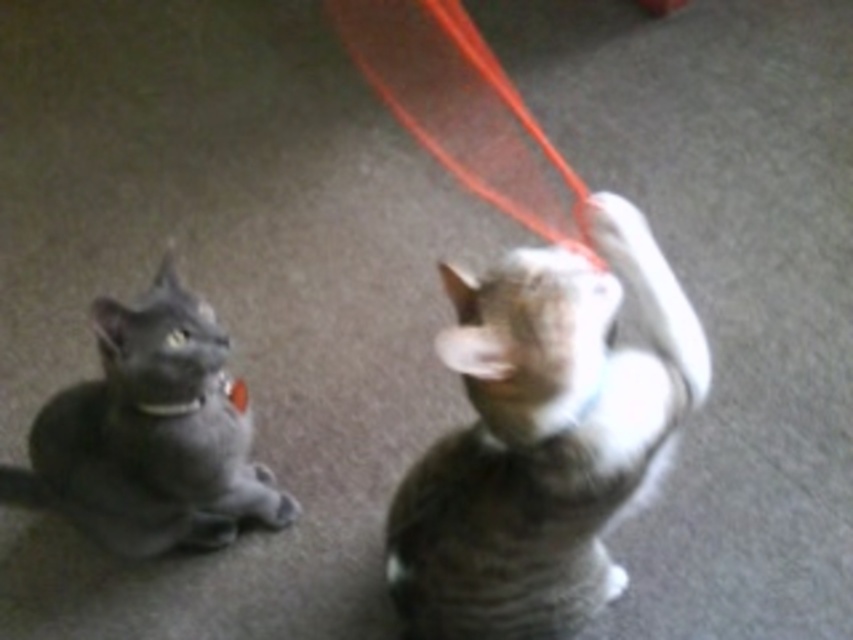
You are a cat owner trying to decide if your matte gray cat at left can reach the red string at upper center. Based on their sizes, can your cat reach the string?

The matte gray cat at left has a smaller size compared to red string at upper center, so it might struggle to reach the string unless it jumps or stretches.

You are a cat owner who wants to place a small toy between the striped fur cat at center and the matte gray cat at left. Can you fit a toy that is 16 inches long between them?

The distance between the striped fur cat at center and the matte gray cat at left is 17.27 inches. Since the toy is 16 inches long, it can fit between them as the space is slightly larger than the toy.

You are a cat owner who wants to ensure your striped fur cat at center can reach the red string at upper center during playtime. Based on the scene, can the cat reach the string?

The striped fur cat at center is not as tall as the red string at upper center, so it may not be able to reach it without jumping or assistance.